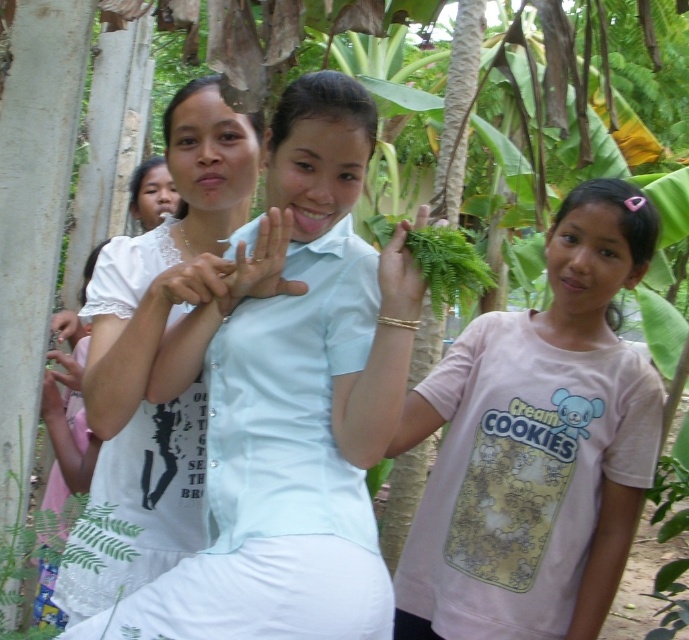
Question: Which point is farther to the camera?

Choices:
 (A) (391, 294)
 (B) (63, 316)

Answer: (B)

Question: From the image, what is the correct spatial relationship of pink cotton shirt at right in relation to white matte hand at center?

Choices:
 (A) right
 (B) left

Answer: (A)

Question: Which object appears closest to the camera in this image?

Choices:
 (A) white matte shirt at center
 (B) white matte hand at center

Answer: (A)

Question: Which point is closer to the camera?

Choices:
 (A) white matte hand at center
 (B) matte white hand at center

Answer: (B)

Question: Is white matte shirt at center thinner than matte white hand at center?

Choices:
 (A) yes
 (B) no

Answer: (B)

Question: Can you confirm if white matte shirt at center is bigger than matte white hand at lower left?

Choices:
 (A) yes
 (B) no

Answer: (A)